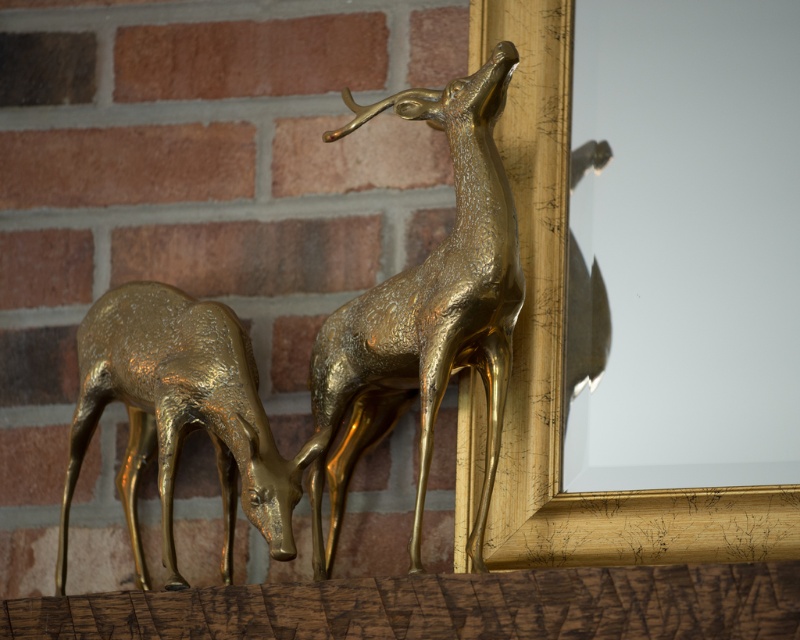
You are standing in front of the two golden deer sculptures. You want to place a small decorative item exactly at the midpoint between the shiny gold deer at upper center and the gold mirror on the right. What are the coordinates of this midpoint?

The coordinates of the midpoint between the shiny gold deer at upper center and the gold mirror on the right would be calculated by averaging their coordinates. Since the shiny gold deer at upper center is at point (x=425, y=310), and the gold mirror on the right is positioned at an unknown coordinate, we cannot determine the exact midpoint without additional information about the mirror.

You are standing in front of the two golden deer sculptures and a mirror. There are two points marked in the image. You want to know which point is closer to you. The points are point [318,550] and point [260,504]. Which point is closer to you?

Point [318,550] is further to the camera than point [260,504]. Therefore, point [260,504] is closer to you.

You are an interior designer planning to place a new sofa in the living room where the two shiny gold deer sculptures are displayed. The sofa will be placed between the shiny gold deer at upper center and the shiny gold deer at left. Considering their sizes, which deer should the sofa be closer to for balance?

The shiny gold deer at upper center is bigger than the shiny gold deer at left, so the sofa should be closer to the smaller shiny gold deer at left to balance the visual weight.